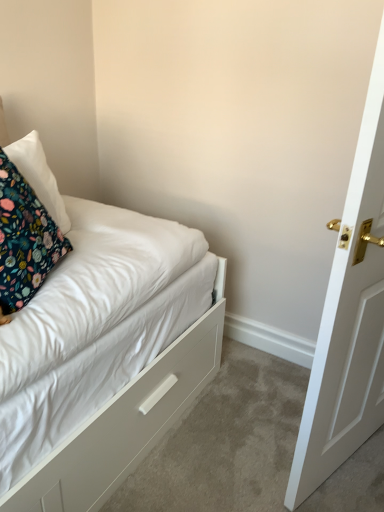
Question: Is floral fabric pillow at left, the first pillow viewed from the front, at the right side of floral fabric pillow at upper left, the 2th pillow positioned from the front?

Choices:
 (A) yes
 (B) no

Answer: (A)

Question: Is floral fabric pillow at left, acting as the 2th pillow starting from the back, taller than floral fabric pillow at upper left, the 2th pillow positioned from the front?

Choices:
 (A) no
 (B) yes

Answer: (B)

Question: Considering the relative sizes of floral fabric pillow at left, the first pillow viewed from the front, and floral fabric pillow at upper left, the first pillow from the back, in the image provided, is floral fabric pillow at left, the first pillow viewed from the front, bigger than floral fabric pillow at upper left, the first pillow from the back,?

Choices:
 (A) yes
 (B) no

Answer: (A)

Question: From a real-world perspective, does floral fabric pillow at left, acting as the 2th pillow starting from the back, stand above floral fabric pillow at upper left, the first pillow from the back?

Choices:
 (A) no
 (B) yes

Answer: (A)

Question: From the image's perspective, would you say floral fabric pillow at left, acting as the 2th pillow starting from the back, is shown under floral fabric pillow at upper left, the 2th pillow positioned from the front?

Choices:
 (A) yes
 (B) no

Answer: (A)

Question: Is white matte drawer at lower left taller or shorter than floral fabric pillow at left, acting as the 2th pillow starting from the back?

Choices:
 (A) tall
 (B) short

Answer: (B)

Question: Based on their sizes in the image, would you say white matte drawer at lower left is bigger or smaller than floral fabric pillow at left, the first pillow viewed from the front?

Choices:
 (A) small
 (B) big

Answer: (B)

Question: Looking at their shapes, would you say white matte drawer at lower left is wider or thinner than floral fabric pillow at left, acting as the 2th pillow starting from the back?

Choices:
 (A) thin
 (B) wide

Answer: (B)

Question: Is white matte drawer at lower left inside or outside of floral fabric pillow at left, the first pillow viewed from the front?

Choices:
 (A) inside
 (B) outside

Answer: (B)

Question: Based on their sizes in the image, would you say floral fabric pillow at left, the first pillow viewed from the front, is bigger or smaller than floral fabric pillow at upper left, the first pillow from the back?

Choices:
 (A) small
 (B) big

Answer: (B)

Question: Is floral fabric pillow at left, acting as the 2th pillow starting from the back, taller or shorter than floral fabric pillow at upper left, the first pillow from the back?

Choices:
 (A) tall
 (B) short

Answer: (A)

Question: Choose the correct answer: Is floral fabric pillow at left, the first pillow viewed from the front, inside floral fabric pillow at upper left, the first pillow from the back, or outside it?

Choices:
 (A) inside
 (B) outside

Answer: (B)

Question: Considering the positions of floral fabric pillow at left, acting as the 2th pillow starting from the back, and floral fabric pillow at upper left, the 2th pillow positioned from the front, in the image, is floral fabric pillow at left, acting as the 2th pillow starting from the back, wider or thinner than floral fabric pillow at upper left, the 2th pillow positioned from the front,?

Choices:
 (A) thin
 (B) wide

Answer: (A)

Question: In terms of size, does floral fabric pillow at upper left, the first pillow from the back, appear bigger or smaller than floral fabric pillow at left, the first pillow viewed from the front?

Choices:
 (A) big
 (B) small

Answer: (B)

Question: In terms of width, does floral fabric pillow at upper left, the first pillow from the back, look wider or thinner when compared to floral fabric pillow at left, the first pillow viewed from the front?

Choices:
 (A) thin
 (B) wide

Answer: (B)